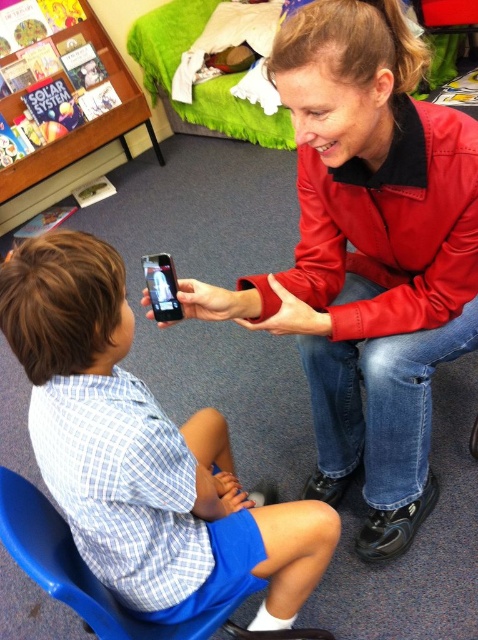
You are a GUI agent. You are given a task and a screenshot of the screen. Output one action in this format:
    pyautogui.click(x=<x>, y=<y>)
    Task: Click on the matte blue shirt at center
    The image size is (478, 640).
    Given the screenshot: What is the action you would take?
    pyautogui.click(x=142, y=452)

Which is in front, point (262, 509) or point (29, 188)?

Point (262, 509)

Does point (61, 401) come farther from viewer compared to point (110, 113)?

No, it is not.

Locate an element on the screen. The height and width of the screenshot is (640, 478). matte blue shirt at center is located at coordinates (142, 452).

At what (x,y) coordinates should I click in order to perform the action: click on red leather jacket at upper center. Please return your answer as a coordinate pair (x, y). Image resolution: width=478 pixels, height=640 pixels. Looking at the image, I should click on (368, 256).

Does red leather jacket at upper center have a lesser width compared to blue plastic chair at lower left?

In fact, red leather jacket at upper center might be wider than blue plastic chair at lower left.

Is point (420, 292) in front of point (229, 611)?

No, (420, 292) is further to viewer.

Find the location of `red leather jacket at upper center`. red leather jacket at upper center is located at coordinates (368, 256).

Can you confirm if blue plastic chair at lower left is shorter than wooden bookshelf at upper left?

Yes.

Is point (188, 620) more distant than point (106, 134)?

No, it is in front of (106, 134).

The height and width of the screenshot is (640, 478). Identify the location of blue plastic chair at lower left. (78, 570).